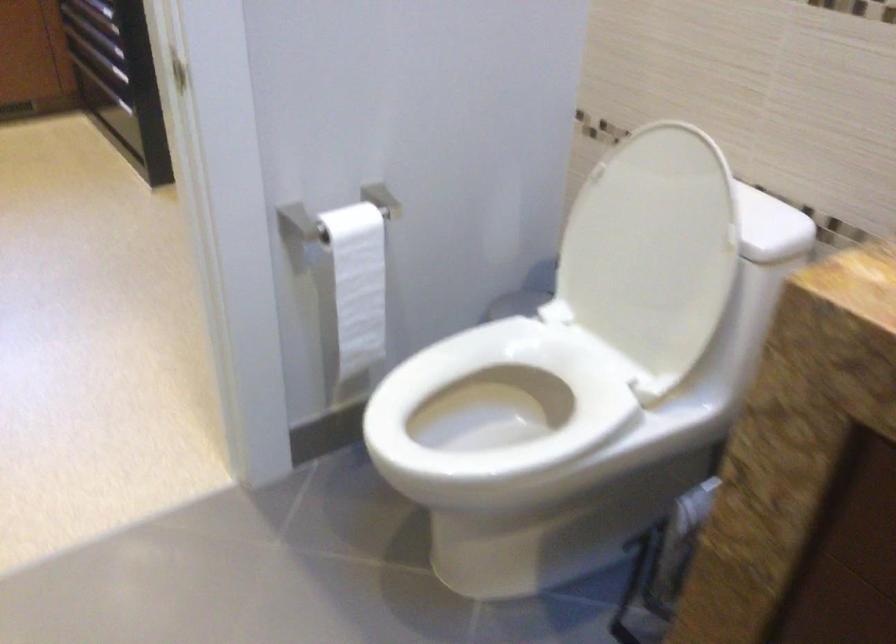
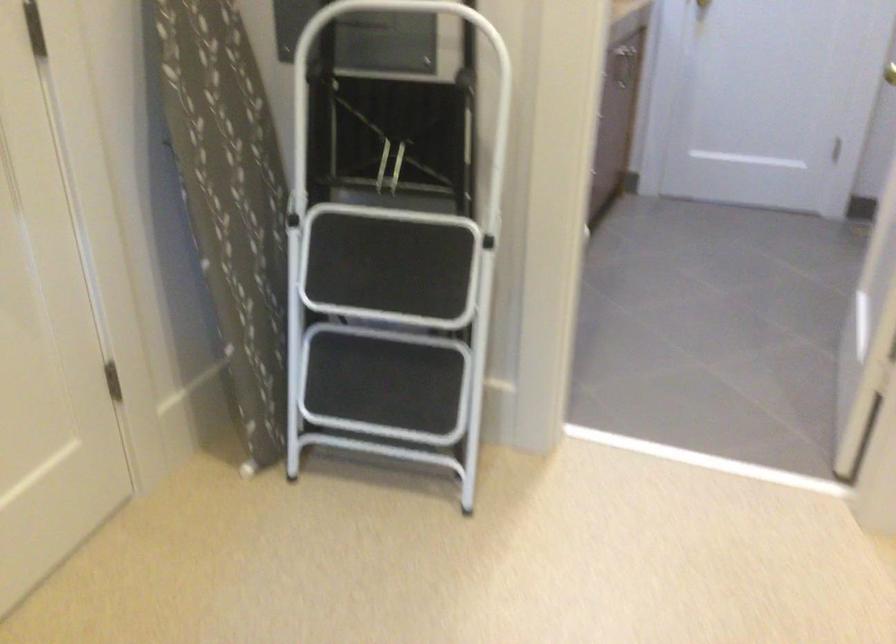
Question: I am providing you with two images of the same scene from different viewpoints. Please identify which objects are invisible in image2.

Choices:
 (A) black stool step
 (B) grey seat cushion
 (C) white toilet seat
 (D) white stool handle

Answer: (C)